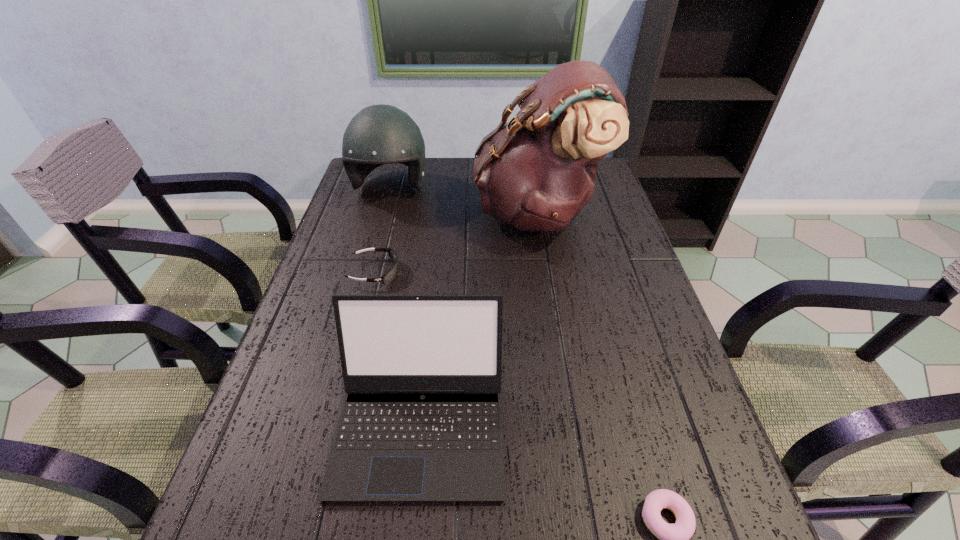
Image resolution: width=960 pixels, height=540 pixels. I want to click on the tallest object, so click(x=536, y=173).

You are a GUI agent. You are given a task and a screenshot of the screen. Output one action in this format:
    pyautogui.click(x=<x>, y=<y>)
    Task: Click on the football helmet
    
    Given the screenshot: What is the action you would take?
    tap(380, 134)

Where is `the third tallest object`? This screenshot has width=960, height=540. the third tallest object is located at coordinates (421, 420).

At what (x,y) coordinates should I click in order to perform the action: click on the fourth tallest object. Please return your answer as a coordinate pair (x, y). This screenshot has width=960, height=540. Looking at the image, I should click on click(392, 272).

Locate an element on the screen. This screenshot has height=540, width=960. free location located at the front of the tallest object with buckles is located at coordinates (406, 212).

What are the coordinates of `blank space located at the front of the tallest object with buckles` in the screenshot? It's located at (406, 212).

Where is `free space located 0.050m at the front of the tallest object with buckles`? free space located 0.050m at the front of the tallest object with buckles is located at coordinates (458, 212).

At what (x,y) coordinates should I click in order to perform the action: click on vacant area situated at the face opening of the football helmet. Please return your answer as a coordinate pair (x, y). Looking at the image, I should click on (378, 231).

Where is `vacant space situated on the surface of the third tallest object`? Image resolution: width=960 pixels, height=540 pixels. vacant space situated on the surface of the third tallest object is located at coordinates (409, 537).

Find the location of a particular element. This screenshot has height=540, width=960. vacant position located on the front and sides of the fourth tallest object is located at coordinates (468, 272).